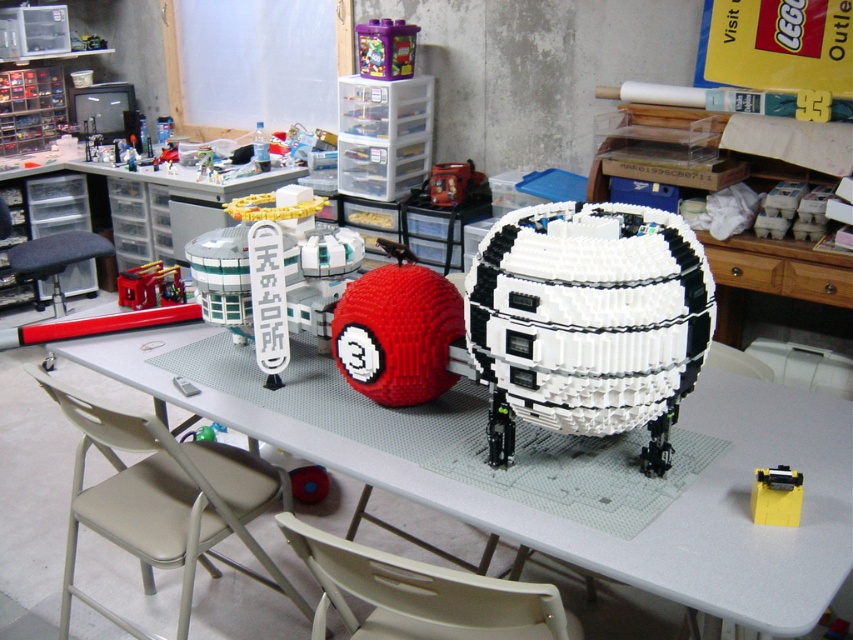
Where is `beige fabric chair at lower left`? beige fabric chair at lower left is located at coordinates (165, 500).

From the picture: Who is more forward, (x=181, y=592) or (x=450, y=188)?

Point (x=181, y=592) is more forward.

I want to click on beige fabric chair at lower left, so click(x=165, y=500).

Is beige plastic chair at lower center smaller than metallic red car at center?

No, beige plastic chair at lower center is not smaller than metallic red car at center.

Is beige plastic chair at lower center bigger than metallic red car at center?

Indeed, beige plastic chair at lower center has a larger size compared to metallic red car at center.

Where is `beige plastic chair at lower center`? The width and height of the screenshot is (853, 640). beige plastic chair at lower center is located at coordinates click(422, 595).

Where is `beige plastic chair at lower center`? The image size is (853, 640). beige plastic chair at lower center is located at coordinates (422, 595).

Which is in front, point (184, 474) or point (172, 269)?

Positioned in front is point (184, 474).

From the picture: Is beige fabric chair at lower left thinner than metallic red car at center?

No, beige fabric chair at lower left is not thinner than metallic red car at center.

Describe the element at coordinates (165, 500) in the screenshot. I see `beige fabric chair at lower left` at that location.

The height and width of the screenshot is (640, 853). Find the location of `beige fabric chair at lower left`. beige fabric chair at lower left is located at coordinates (165, 500).